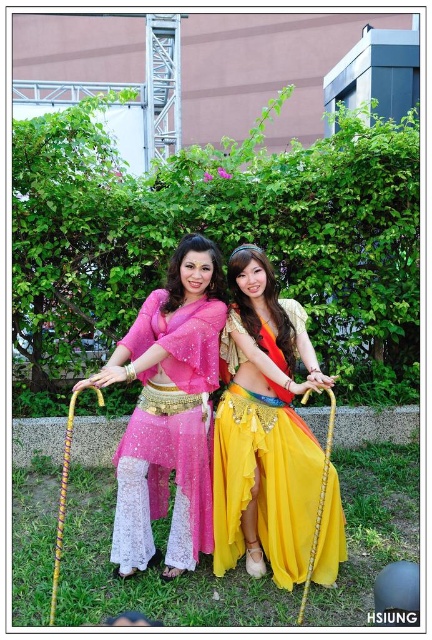
You are a photographer taking a picture of the shiny yellow fabric skirt at center and the pink lace pants at center. Which one will appear larger in the photo?

The shiny yellow fabric skirt at center will appear larger in the photo because it is closer to the viewer than the pink lace pants at center.

You are standing between the two people in the scene. The shiny yellow fabric skirt at center is worn by the person on the right. If you want to give a gift to the person on the left without the person on the right seeing, which direction should you approach from?

You should approach from the side opposite to the shiny yellow fabric skirt at center, which is the left side, to avoid being seen by the person on the right.

You are a costume designer preparing for a performance. You need to decide which costume to adjust first based on their sizes. Which costume piece is smaller between the shiny yellow fabric skirt at center and the pink lace pants at center?

The shiny yellow fabric skirt at center is smaller than the pink lace pants at center, so you should adjust the shiny yellow fabric skirt at center first if prioritizing smaller pieces.